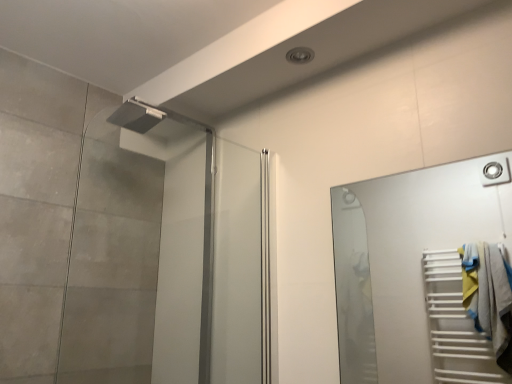
The height and width of the screenshot is (384, 512). What do you see at coordinates (163, 258) in the screenshot?
I see `matte silver shower head at upper left` at bounding box center [163, 258].

Locate an element on the screen. The width and height of the screenshot is (512, 384). matte silver shower head at upper left is located at coordinates (163, 258).

This screenshot has height=384, width=512. What do you see at coordinates (424, 274) in the screenshot?
I see `white glossy towel rack at right` at bounding box center [424, 274].

Locate an element on the screen. The width and height of the screenshot is (512, 384). white glossy towel rack at right is located at coordinates (424, 274).

Image resolution: width=512 pixels, height=384 pixels. What are the coordinates of `matte silver shower head at upper left` in the screenshot? It's located at (163, 258).

Visually, is white glossy towel rack at right positioned to the left or to the right of matte silver shower head at upper left?

From the image, it's evident that white glossy towel rack at right is to the right of matte silver shower head at upper left.

Does white glossy towel rack at right lie behind matte silver shower head at upper left?

No, white glossy towel rack at right is closer to the viewer.

From the picture: Which is less distant, (391,233) or (94,230)?

Positioned in front is point (94,230).

From the image's perspective, is white glossy towel rack at right below matte silver shower head at upper left?

Correct, white glossy towel rack at right appears lower than matte silver shower head at upper left in the image.

From a real-world perspective, is white glossy towel rack at right beneath matte silver shower head at upper left?

Correct, in the physical world, white glossy towel rack at right is lower than matte silver shower head at upper left.

Which of these two, white glossy towel rack at right or matte silver shower head at upper left, is thinner?

white glossy towel rack at right is thinner.

Which of these two, white glossy towel rack at right or matte silver shower head at upper left, stands taller?

matte silver shower head at upper left is taller.

Looking at the image, does white glossy towel rack at right seem bigger or smaller compared to matte silver shower head at upper left?

In the image, white glossy towel rack at right appears to be smaller than matte silver shower head at upper left.

Do you think white glossy towel rack at right is within matte silver shower head at upper left, or outside of it?

white glossy towel rack at right is spatially situated outside matte silver shower head at upper left.

Are white glossy towel rack at right and matte silver shower head at upper left making contact?

No, white glossy towel rack at right is not in contact with matte silver shower head at upper left.

Is white glossy towel rack at right turned away from matte silver shower head at upper left?

No.

Find the location of a particular element. The image size is (512, 384). door in front of the matte silver shower head at upper left is located at coordinates 424,274.

Between matte silver shower head at upper left and white glossy towel rack at right, which one appears on the left side from the viewer's perspective?

matte silver shower head at upper left.

In the image, is matte silver shower head at upper left positioned in front of or behind white glossy towel rack at right?

Visually, matte silver shower head at upper left is located behind white glossy towel rack at right.

Does point (105, 341) come closer to viewer compared to point (428, 372)?

That is True.

From the picture: From the image's perspective, which object appears higher, matte silver shower head at upper left or white glossy towel rack at right?

matte silver shower head at upper left is shown above in the image.

From a real-world perspective, which is physically below, matte silver shower head at upper left or white glossy towel rack at right?

white glossy towel rack at right is physically lower.

Between matte silver shower head at upper left and white glossy towel rack at right, which one has larger width?

With larger width is matte silver shower head at upper left.

In terms of height, does matte silver shower head at upper left look taller or shorter compared to white glossy towel rack at right?

In the image, matte silver shower head at upper left appears to be taller than white glossy towel rack at right.

Considering the relative sizes of matte silver shower head at upper left and white glossy towel rack at right in the image provided, is matte silver shower head at upper left bigger than white glossy towel rack at right?

Yes, matte silver shower head at upper left is bigger than white glossy towel rack at right.

Is matte silver shower head at upper left located outside white glossy towel rack at right?

matte silver shower head at upper left lies outside white glossy towel rack at right's area.

Are matte silver shower head at upper left and white glossy towel rack at right far apart?

Yes, matte silver shower head at upper left and white glossy towel rack at right are quite far apart.

Could you tell me if matte silver shower head at upper left is facing white glossy towel rack at right?

Yes, matte silver shower head at upper left faces towards white glossy towel rack at right.

The image size is (512, 384). In the image, there is a white glossy towel rack at right. Identify the location of screen door above it (from the image's perspective). (163, 258).

The image size is (512, 384). I want to click on screen door above the white glossy towel rack at right (from the image's perspective), so click(x=163, y=258).

At what (x,y) coordinates should I click in order to perform the action: click on door below the matte silver shower head at upper left (from a real-world perspective). Please return your answer as a coordinate pair (x, y). Looking at the image, I should click on coord(424,274).